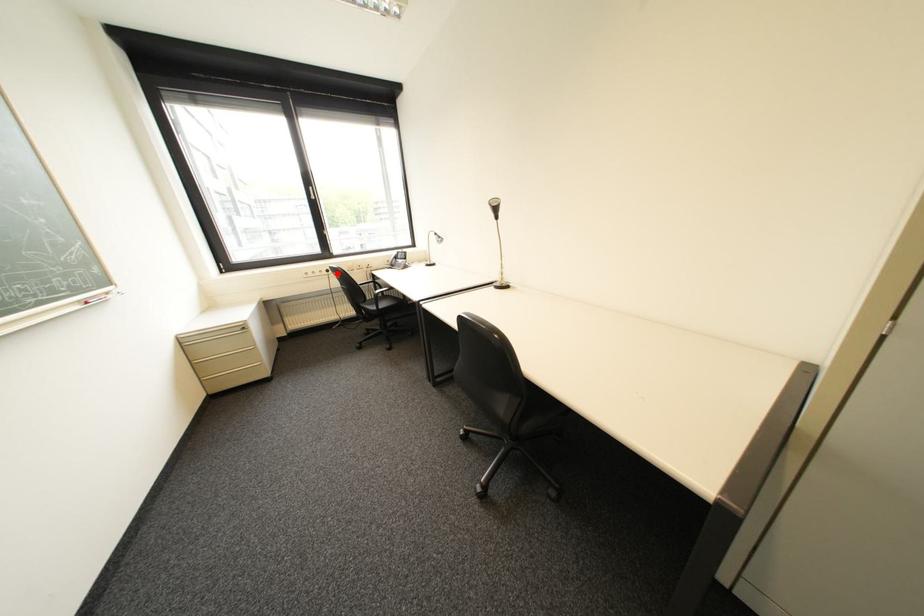
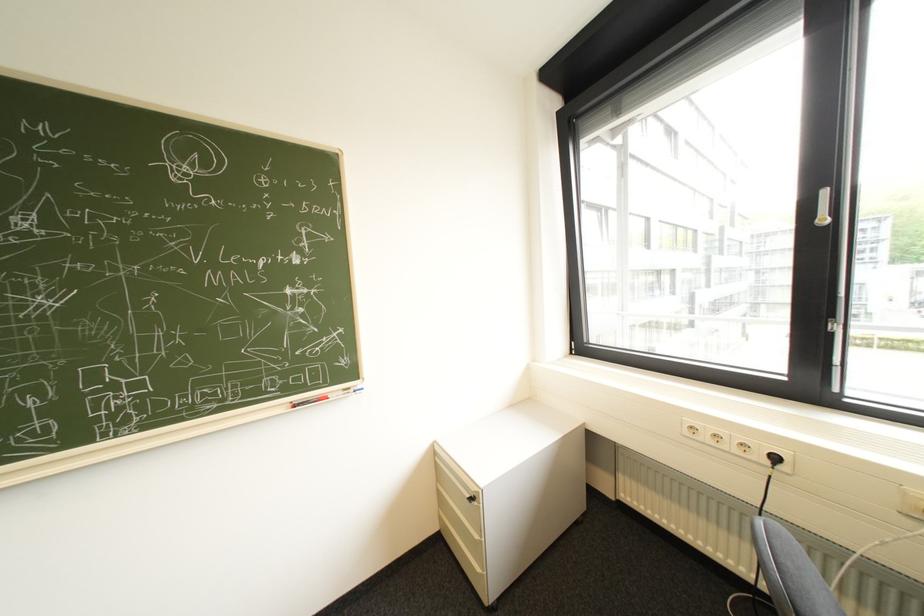
In the second image, find the point that corresponds to the highlighted location in the first image.

(779, 463)